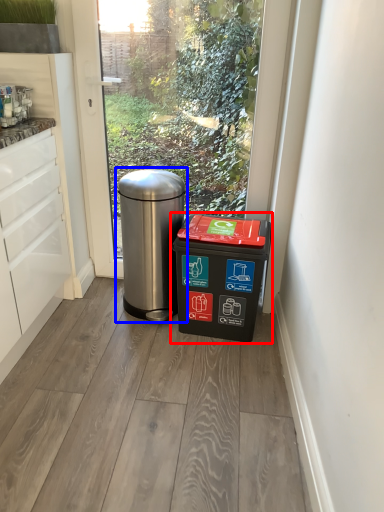
Question: Which point is further to the camera, waste container (highlighted by a red box) or waste container (highlighted by a blue box)?

Choices:
 (A) waste container
 (B) waste container

Answer: (B)